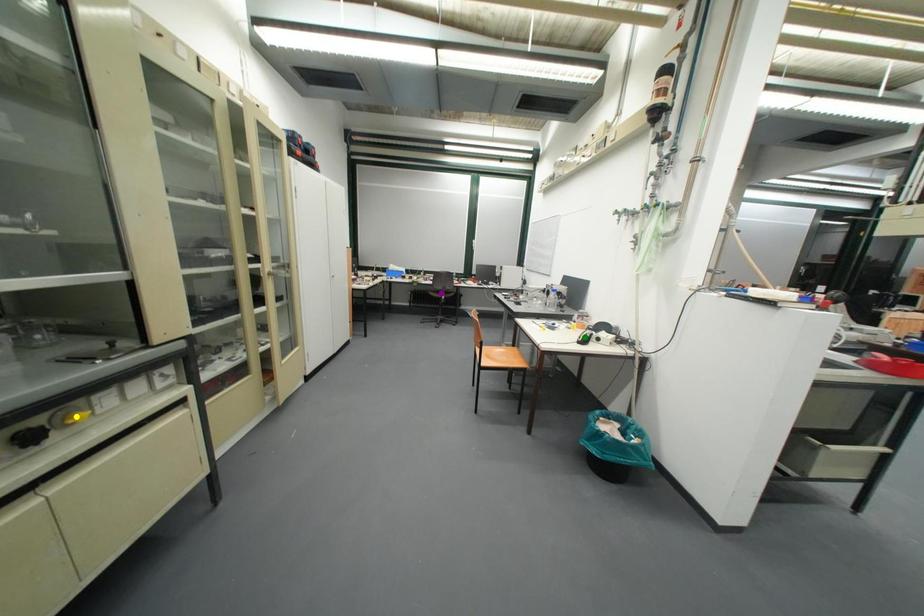
Order these from nearest to farthest:
A) yellow point
B) purple point
C) green point

yellow point → green point → purple point